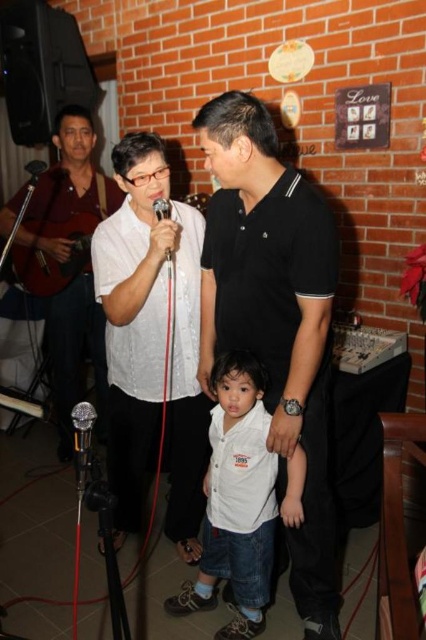
Is white matte shirt at center positioned behind silver metallic microphone at lower left?

Yes, it is.

Is white matte shirt at center shorter than silver metallic microphone at lower left?

No, white matte shirt at center is not shorter than silver metallic microphone at lower left.

Where is `white matte shirt at center`? This screenshot has height=640, width=426. white matte shirt at center is located at coordinates (152, 340).

I want to click on black plastic microphone at center, so click(161, 209).

Does point (163, 198) come in front of point (32, 161)?

Yes, it is.

Which is behind, point (167, 211) or point (43, 168)?

Positioned behind is point (43, 168).

This screenshot has height=640, width=426. I want to click on black plastic microphone at center, so click(x=161, y=209).

Is black cotton polo shirt at center positioned before white matte shirt at center?

Yes, it is in front of white matte shirt at center.

Who is taller, black cotton polo shirt at center or white matte shirt at center?

black cotton polo shirt at center is taller.

Is point (222, 152) farther from camera compared to point (149, 192)?

No.

You are a GUI agent. You are given a task and a screenshot of the screen. Output one action in this format:
    pyautogui.click(x=<x>, y=<y>)
    Task: Click on the black cotton polo shirt at center
    This screenshot has width=426, height=640.
    Given the screenshot: What is the action you would take?
    pyautogui.click(x=275, y=317)